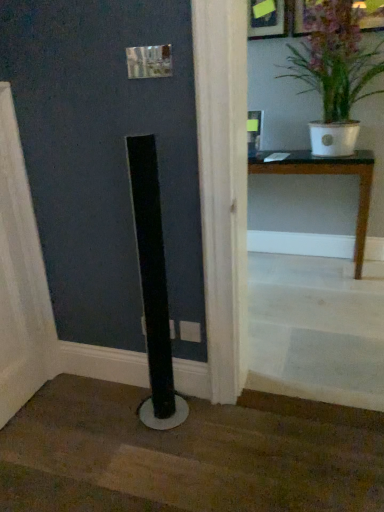
Question: From the image's perspective, would you say white glossy pot at upper right is positioned over white wooden stairs at lower right, the 2th stairwell in the bottom-to-top sequence?

Choices:
 (A) no
 (B) yes

Answer: (B)

Question: Is white glossy pot at upper right further to camera compared to white wooden stairs at lower right, which is the first stairwell from top to bottom?

Choices:
 (A) yes
 (B) no

Answer: (A)

Question: Considering the relative sizes of white glossy pot at upper right and white wooden stairs at lower right, which is the first stairwell from top to bottom, in the image provided, is white glossy pot at upper right smaller than white wooden stairs at lower right, which is the first stairwell from top to bottom,?

Choices:
 (A) yes
 (B) no

Answer: (B)

Question: Can you confirm if white glossy pot at upper right is taller than white wooden stairs at lower right, which is the first stairwell from top to bottom?

Choices:
 (A) yes
 (B) no

Answer: (A)

Question: Is white glossy pot at upper right at the left side of white wooden stairs at lower right, the 2th stairwell in the bottom-to-top sequence?

Choices:
 (A) no
 (B) yes

Answer: (A)

Question: Is white glossy pot at upper right looking in the opposite direction of white wooden stairs at lower right, which is the first stairwell from top to bottom?

Choices:
 (A) yes
 (B) no

Answer: (B)

Question: Is white glossy pot at upper right a part of black matte pole at lower center, positioned as the first stairwell in bottom-to-top order?

Choices:
 (A) no
 (B) yes

Answer: (A)

Question: Is black matte pole at lower center, positioned as the first stairwell in bottom-to-top order, taller than white glossy pot at upper right?

Choices:
 (A) yes
 (B) no

Answer: (B)

Question: From the image's perspective, is black matte pole at lower center, which appears as the 2th stairwell when viewed from the top, beneath white glossy pot at upper right?

Choices:
 (A) no
 (B) yes

Answer: (B)

Question: Does black matte pole at lower center, positioned as the first stairwell in bottom-to-top order, have a greater width compared to white glossy pot at upper right?

Choices:
 (A) yes
 (B) no

Answer: (A)

Question: Is the position of black matte pole at lower center, positioned as the first stairwell in bottom-to-top order, less distant than that of white glossy pot at upper right?

Choices:
 (A) yes
 (B) no

Answer: (A)

Question: Can you confirm if black matte pole at lower center, positioned as the first stairwell in bottom-to-top order, is shorter than white glossy pot at upper right?

Choices:
 (A) yes
 (B) no

Answer: (A)

Question: Is white glossy pot at upper right to the left of black matte pole at lower center, positioned as the first stairwell in bottom-to-top order, from the viewer's perspective?

Choices:
 (A) no
 (B) yes

Answer: (A)